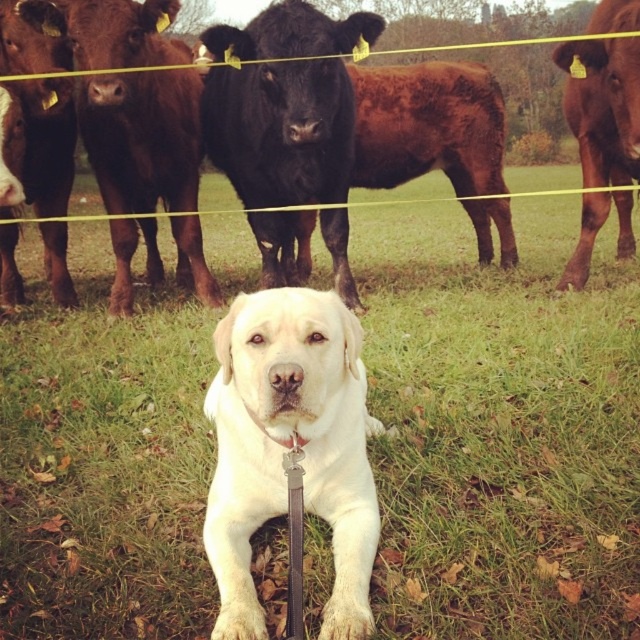
Question: From the image, what is the correct spatial relationship of brown glossy bull at right in relation to brown glossy cow at left?

Choices:
 (A) left
 (B) right

Answer: (B)

Question: Does white matte dog at center have a lesser width compared to brown glossy bull at right?

Choices:
 (A) yes
 (B) no

Answer: (A)

Question: Which object is the farthest from the brown glossy cow at left?

Choices:
 (A) brown glossy bull at right
 (B) green grass at center
 (C) brown glossy bull at left

Answer: (A)

Question: Estimate the real-world distances between objects in this image. Which object is closer to the shiny brown cow at center?

Choices:
 (A) black glossy bull at center
 (B) brown glossy cow at left
 (C) green grass at center

Answer: (A)

Question: Which point appears farthest from the camera in this image?

Choices:
 (A) tap(621, 125)
 (B) tap(152, 144)

Answer: (B)

Question: Can you confirm if shiny brown cow at center is positioned below brown glossy bull at right?

Choices:
 (A) yes
 (B) no

Answer: (B)